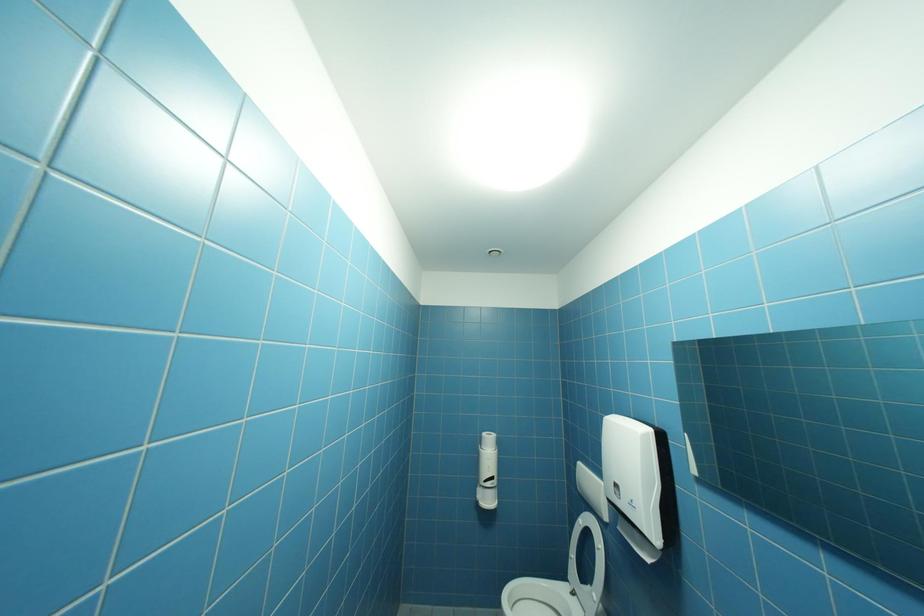
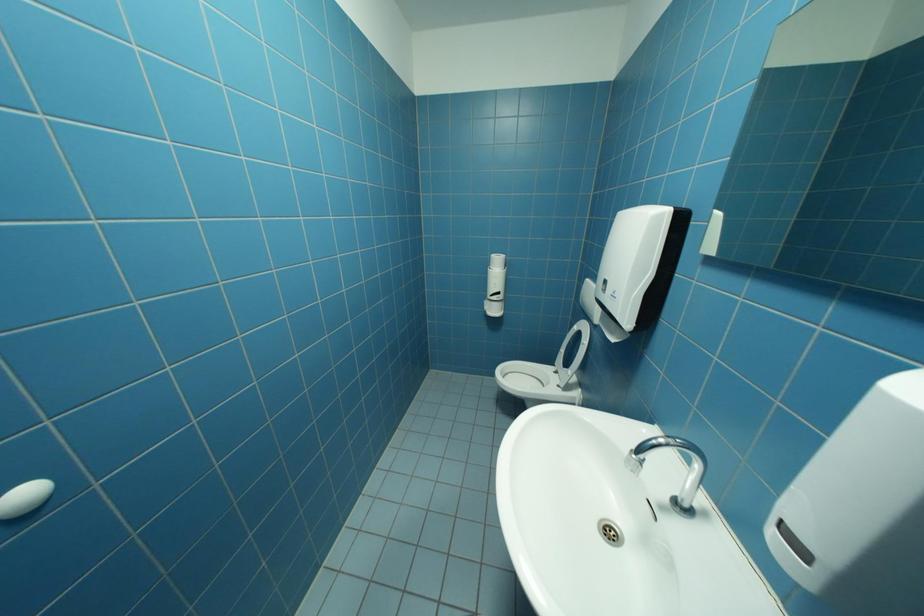
Question: The first image is from the beginning of the video and the second image is from the end. How did the camera likely rotate when shooting the video?

Choices:
 (A) Left
 (B) Right
 (C) Up
 (D) Down

Answer: (D)